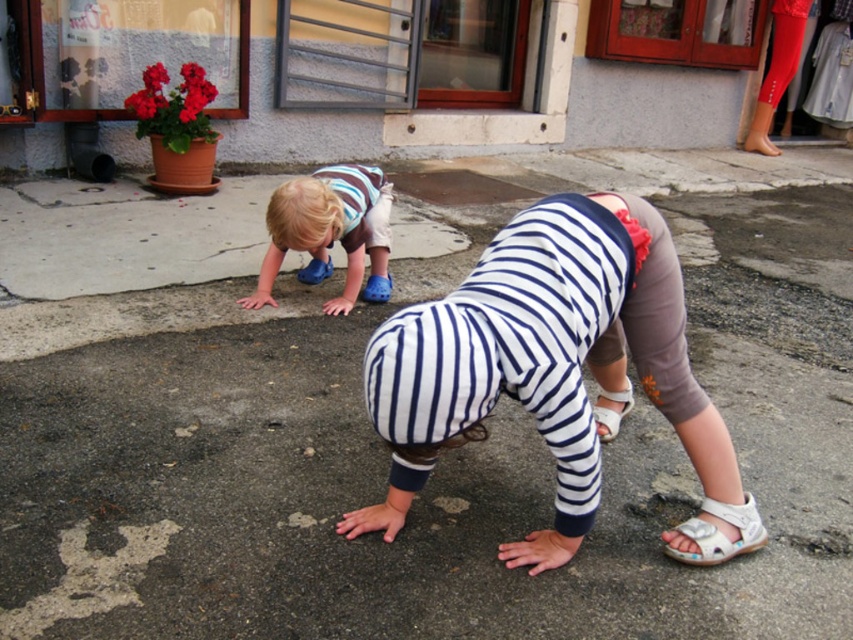
You are a photographer trying to capture the two children in the scene. You notice that the white striped shirt at center is exactly at point (543,360). If you want to frame the shot so that this point is at the very center of your viewfinder, which direction should you move your camera?

You should center your camera on the point (543,360) where the white striped shirt at center is located.

You are a photographer trying to capture a photo of the children. You need to ensure both the matte blue shoes at lower left and the white leather sandal at lower right are visible in the frame. Based on their positions, which of the two shoes is higher up in the image?

The matte blue shoes at lower left is above the white leather sandal at lower right in the image.

You are a photographer trying to capture both the white striped shirt at center and the matte blue shoes at lower left in a single shot. Based on their positions, which object should you focus on first to ensure both are in frame?

Since the white striped shirt at center is to the right of matte blue shoes at lower left, you should focus on the matte blue shoes at lower left first to ensure both are in the frame.